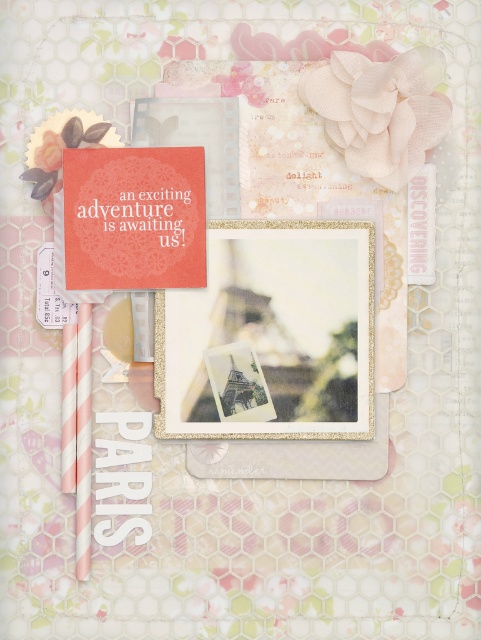
Question: Is matte pink paper flower at upper center closer to the viewer compared to peachy paper flower at upper center?

Choices:
 (A) yes
 (B) no

Answer: (A)

Question: Which point is closer to the camera taking this photo?

Choices:
 (A) (36, 134)
 (B) (240, 77)
 (C) (288, 259)
 (D) (413, 172)

Answer: (D)

Question: Among these points, which one is farthest from the camera?

Choices:
 (A) (179, 186)
 (B) (50, 148)
 (C) (250, 385)
 (D) (243, 92)

Answer: (D)

Question: Which point appears farthest from the camera in this image?

Choices:
 (A) (370, 230)
 (B) (36, 150)

Answer: (A)

Question: Is peachy fabric flower at upper right to the right of matte pink paper flower at upper center from the viewer's perspective?

Choices:
 (A) no
 (B) yes

Answer: (B)

Question: From the image, what is the correct spatial relationship of coral paper postcard at center in relation to peachy paper flower at upper center?

Choices:
 (A) left
 (B) right

Answer: (A)